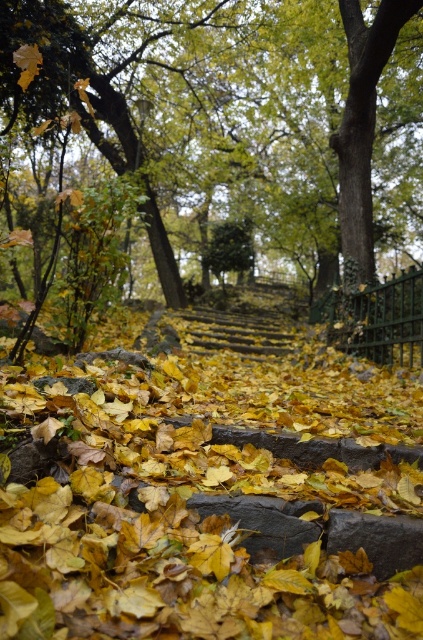
You are standing at the bottom of the stone steps and want to place a small decorative pot exactly at the center of the yellow leaf litter at center. According to the coordinates provided, where should you place the pot?

You should place the pot at the coordinates point (206, 499) where the yellow leaf litter at center is located.